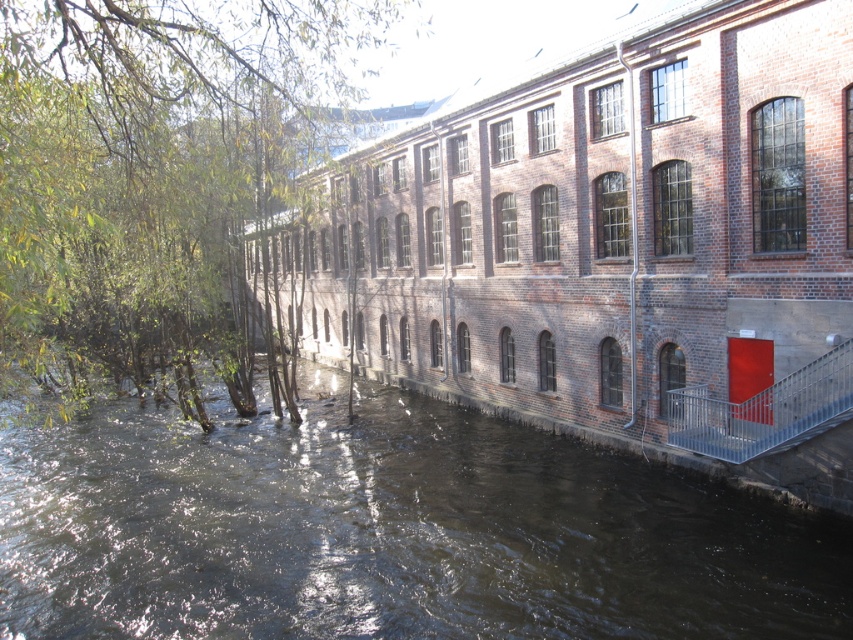
Is green leafy tree at left taller than metallic silver railing at lower right?

Indeed, green leafy tree at left has a greater height compared to metallic silver railing at lower right.

Can you confirm if green leafy tree at left is positioned to the right of metallic silver railing at lower right?

In fact, green leafy tree at left is to the left of metallic silver railing at lower right.

Describe the element at coordinates (148, 182) in the screenshot. Image resolution: width=853 pixels, height=640 pixels. I see `green leafy tree at left` at that location.

The height and width of the screenshot is (640, 853). Find the location of `green leafy tree at left`. green leafy tree at left is located at coordinates (148, 182).

Can you confirm if dark brown water at center is positioned to the left of metallic silver railing at lower right?

Indeed, dark brown water at center is positioned on the left side of metallic silver railing at lower right.

Does dark brown water at center have a lesser height compared to metallic silver railing at lower right?

Yes.

Which is behind, point (384, 465) or point (701, 412)?

The point (384, 465) is more distant.

You are a GUI agent. You are given a task and a screenshot of the screen. Output one action in this format:
    pyautogui.click(x=<x>, y=<y>)
    Task: Click on the dark brown water at center
    This screenshot has height=640, width=853.
    Given the screenshot: What is the action you would take?
    pyautogui.click(x=389, y=531)

Can you confirm if dark brown water at center is wider than green leafy tree at left?

Yes, dark brown water at center is wider than green leafy tree at left.

Does point (67, 600) lie in front of point (173, 180)?

That is False.

Is point (370, 499) positioned behind point (131, 257)?

No, it is not.

Where is `dark brown water at center`? The height and width of the screenshot is (640, 853). dark brown water at center is located at coordinates (389, 531).